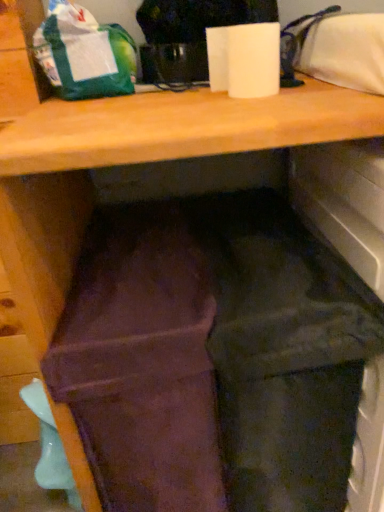
Describe the element at coordinates (84, 54) in the screenshot. I see `green matte bag at upper left` at that location.

What is the approximate height of white matte paper towel at upper center?

white matte paper towel at upper center is 4.35 inches in height.

This screenshot has height=512, width=384. What are the coordinates of `brown suede wallet at center` in the screenshot? It's located at (141, 362).

Does point (120, 381) come in front of point (33, 412)?

Yes, point (120, 381) is in front of point (33, 412).

Which object is further away from the camera, brown suede wallet at center or matte teal plastic spoon at lower left?

Positioned behind is matte teal plastic spoon at lower left.

How many degrees apart are the facing directions of brown suede wallet at center and matte teal plastic spoon at lower left?

The facing directions of brown suede wallet at center and matte teal plastic spoon at lower left are 1.45 degrees apart.

The height and width of the screenshot is (512, 384). I want to click on waste below the brown suede wallet at center (from a real-world perspective), so click(x=50, y=447).

Is green matte bag at upper left positioned in front of white matte paper towel at upper center?

No, green matte bag at upper left is behind white matte paper towel at upper center.

Visually, is green matte bag at upper left positioned to the left or to the right of white matte paper towel at upper center?

In the image, green matte bag at upper left appears on the left side of white matte paper towel at upper center.

Which is closer, (47,21) or (227,37)?

The point (227,37) is closer.

From the image's perspective, is green matte bag at upper left on white matte paper towel at upper center?

Correct, green matte bag at upper left appears higher than white matte paper towel at upper center in the image.

Are matte teal plastic spoon at lower left and green matte bag at upper left beside each other?

No, matte teal plastic spoon at lower left is not with green matte bag at upper left.

How many degrees apart are the facing directions of matte teal plastic spoon at lower left and green matte bag at upper left?

2.47 degrees.

From the image's perspective, is matte teal plastic spoon at lower left below green matte bag at upper left?

Yes.

Can you confirm if matte teal plastic spoon at lower left is positioned to the left of green matte bag at upper left?

Correct, you'll find matte teal plastic spoon at lower left to the left of green matte bag at upper left.

Is point (126, 373) in front of point (96, 63)?

That is True.

Would you say brown suede wallet at center is a long distance from green matte bag at upper left?

No, brown suede wallet at center is in close proximity to green matte bag at upper left.

Does brown suede wallet at center turn towards green matte bag at upper left?

No.

Is point (50, 477) farther from viewer compared to point (130, 368)?

Yes, point (50, 477) is farther from viewer.

Locate an element on the screen. The width and height of the screenshot is (384, 512). waste below the brown suede wallet at center (from the image's perspective) is located at coordinates (50, 447).

Does matte teal plastic spoon at lower left turn towards brown suede wallet at center?

No, matte teal plastic spoon at lower left is not oriented towards brown suede wallet at center.

Does brown suede wallet at center have a smaller size compared to white matte paper towel at upper center?

Incorrect, brown suede wallet at center is not smaller in size than white matte paper towel at upper center.

Who is shorter, brown suede wallet at center or white matte paper towel at upper center?

With less height is white matte paper towel at upper center.

In the image, is brown suede wallet at center positioned in front of or behind white matte paper towel at upper center?

Visually, brown suede wallet at center is located in front of white matte paper towel at upper center.

In the image, is brown suede wallet at center on the left side or the right side of white matte paper towel at upper center?

Clearly, brown suede wallet at center is on the left of white matte paper towel at upper center in the image.

From the image's perspective, is white matte paper towel at upper center above brown suede wallet at center?

Yes, from the image's perspective, white matte paper towel at upper center is on top of brown suede wallet at center.

Which is closer, (279, 70) or (154, 413)?

The point (154, 413) is more forward.

Which of these two, white matte paper towel at upper center or brown suede wallet at center, is thinner?

white matte paper towel at upper center.

Do you think white matte paper towel at upper center is within brown suede wallet at center, or outside of it?

white matte paper towel at upper center lies outside brown suede wallet at center.

Where is `wide above the matte teal plastic spoon at lower left (from a real-world perspective)`? The image size is (384, 512). wide above the matte teal plastic spoon at lower left (from a real-world perspective) is located at coordinates (141, 362).

This screenshot has height=512, width=384. What are the coordinates of `bag behind the white matte paper towel at upper center` in the screenshot? It's located at (84, 54).

From the image, which object appears to be farther from green matte bag at upper left, matte teal plastic spoon at lower left or brown suede wallet at center?

matte teal plastic spoon at lower left.

In the scene shown: When comparing their distances from brown suede wallet at center, does green matte bag at upper left or matte teal plastic spoon at lower left seem further?

green matte bag at upper left.

In the scene shown: From the image, which object appears to be farther from matte teal plastic spoon at lower left, white matte paper towel at upper center or brown suede wallet at center?

white matte paper towel at upper center lies further to matte teal plastic spoon at lower left than the other object.

Which object lies further to the anchor point brown suede wallet at center, white matte paper towel at upper center or green matte bag at upper left?

Based on the image, green matte bag at upper left appears to be further to brown suede wallet at center.

Based on their spatial positions, is matte teal plastic spoon at lower left or brown suede wallet at center further from white matte paper towel at upper center?

matte teal plastic spoon at lower left.

Which object lies further to the anchor point white matte paper towel at upper center, green matte bag at upper left or brown suede wallet at center?

brown suede wallet at center is further to white matte paper towel at upper center.

In the scene shown: Which object lies nearer to the anchor point brown suede wallet at center, matte teal plastic spoon at lower left or green matte bag at upper left?

matte teal plastic spoon at lower left.

From the image, which object appears to be nearer to matte teal plastic spoon at lower left, green matte bag at upper left or brown suede wallet at center?

Among the two, brown suede wallet at center is located nearer to matte teal plastic spoon at lower left.

Identify the location of paper towel between green matte bag at upper left and brown suede wallet at center from top to bottom. (244, 60).

The width and height of the screenshot is (384, 512). I want to click on paper towel between green matte bag at upper left and matte teal plastic spoon at lower left in the vertical direction, so click(x=244, y=60).

Locate an element on the screen. The height and width of the screenshot is (512, 384). wide between green matte bag at upper left and matte teal plastic spoon at lower left vertically is located at coordinates (141, 362).

You are a GUI agent. You are given a task and a screenshot of the screen. Output one action in this format:
    pyautogui.click(x=<x>, y=<y>)
    Task: Click on the wide between white matte paper towel at upper center and matte teal plastic spoon at lower left vertically
    The height and width of the screenshot is (512, 384).
    Given the screenshot: What is the action you would take?
    pyautogui.click(x=141, y=362)